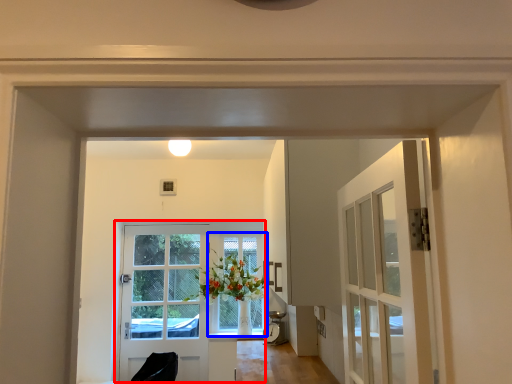
Question: Among these objects, which one is nearest to the camera, door (highlighted by a red box) or window (highlighted by a blue box)?

Choices:
 (A) door
 (B) window

Answer: (A)